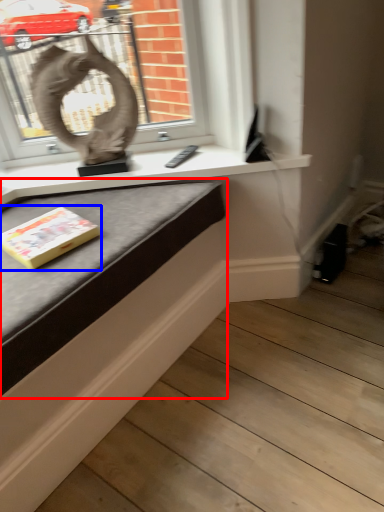
Question: Which of the following is the closest to the observer, table (highlighted by a red box) or paperback book (highlighted by a blue box)?

Choices:
 (A) table
 (B) paperback book

Answer: (A)